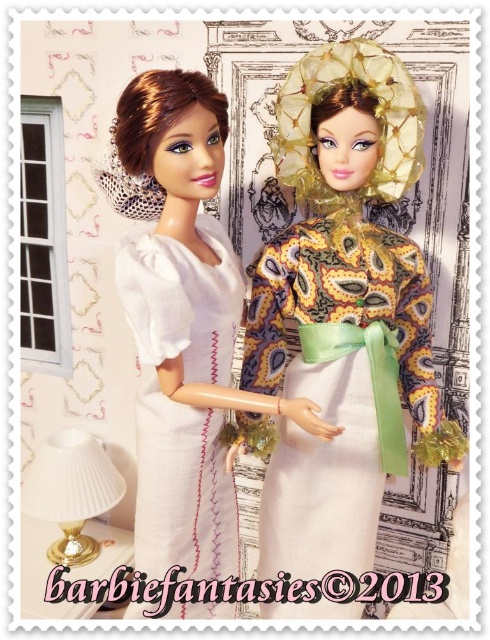
Question: Can you confirm if white fabric dress at left is positioned to the right of white pleated lampshade at lower left?

Choices:
 (A) yes
 (B) no

Answer: (A)

Question: Does white linen dress at left have a smaller size compared to white pleated lampshade at lower left?

Choices:
 (A) yes
 (B) no

Answer: (B)

Question: Which of the following is the closest to the observer?

Choices:
 (A) (290, 493)
 (B) (200, 540)

Answer: (B)

Question: Which point is farther to the camera?

Choices:
 (A) (162, 472)
 (B) (154, 320)
 (C) (68, 432)

Answer: (C)

Question: Which point is closer to the camera taking this photo?

Choices:
 (A) (184, 212)
 (B) (230, 339)
 (C) (269, 285)

Answer: (A)

Question: Can you confirm if white fabric dress at left is positioned to the right of white linen dress at left?

Choices:
 (A) no
 (B) yes

Answer: (B)